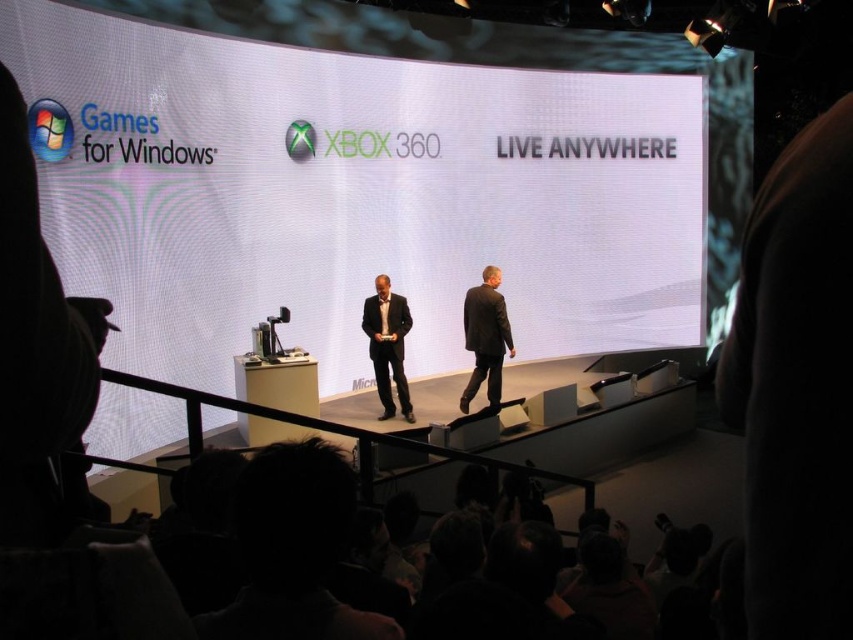
Consider the image. Which of these two, white matte projection screen at upper center or dark gray suit at center, stands taller?

With more height is white matte projection screen at upper center.

Is white matte projection screen at upper center smaller than dark gray suit at center?

No.

Which is in front, point (596, 348) or point (463, 310)?

Point (463, 310) is more forward.

Where is `white matte projection screen at upper center`? This screenshot has width=853, height=640. white matte projection screen at upper center is located at coordinates (384, 188).

The width and height of the screenshot is (853, 640). Describe the element at coordinates (384, 188) in the screenshot. I see `white matte projection screen at upper center` at that location.

Does point (538, 150) come closer to viewer compared to point (399, 317)?

No, (538, 150) is behind (399, 317).

You are a GUI agent. You are given a task and a screenshot of the screen. Output one action in this format:
    pyautogui.click(x=<x>, y=<y>)
    Task: Click on the white matte projection screen at upper center
    This screenshot has width=853, height=640.
    Given the screenshot: What is the action you would take?
    pyautogui.click(x=384, y=188)

Which of these two, dark gray suit at center or black suit at center, stands taller?

dark gray suit at center

Can you confirm if dark gray suit at center is shorter than black suit at center?

No.

You are a GUI agent. You are given a task and a screenshot of the screen. Output one action in this format:
    pyautogui.click(x=<x>, y=<y>)
    Task: Click on the dark gray suit at center
    This screenshot has height=640, width=853.
    Given the screenshot: What is the action you would take?
    pyautogui.click(x=485, y=337)